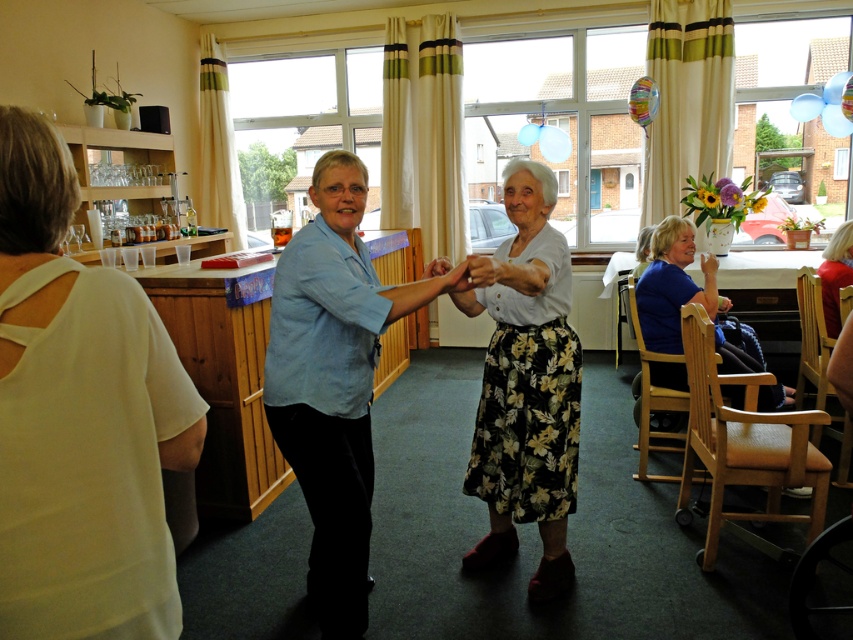
You are standing at the origin point in the image. Which of the two points, point (x=18, y=120) or point (x=657, y=253), is closer to you?

Point (x=18, y=120) is closer to you because it is in front of point (x=657, y=253).

You are a photographer trying to capture a photo of both the white cotton shirt at left and the blue fabric chair at lower right in the same frame. The camera you are using has a maximum focus range of 9 feet. Will you be able to include both objects in focus without moving the camera?

The white cotton shirt at left and blue fabric chair at lower right are 9.35 feet apart from each other. Since the distance between them exceeds the camera maximum focus range of 9 feet, you won

You are organizing a clothing donation drive and need to pack items into boxes. You have a box that can only hold items with a thickness of up to 2 inches. You have the white cotton shirt at left and the floral cotton skirt at center. Which item can fit into the box based on their thickness?

The white cotton shirt at left is thinner than the floral cotton skirt at center. Since the box can hold items up to 2 inches thick, the white cotton shirt at left is more likely to fit within the thickness limit.